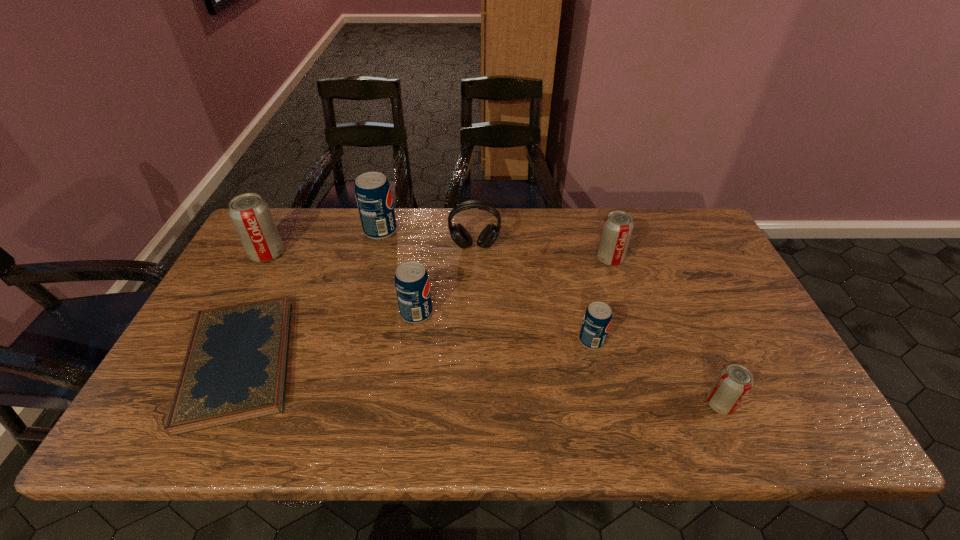
Locate an element on the screen. empty location between the rightmost soda can and the leftmost gray soda can is located at coordinates (493, 329).

At what (x,y) coordinates should I click in order to perform the action: click on blank region between the farthest soda can and the fifth object from left to right. Please return your answer as a coordinate pair (x, y). Looking at the image, I should click on (427, 239).

Locate an element on the screen. vacant space that is in between the fifth soda can from left to right and the third nearest soda can is located at coordinates (x=513, y=286).

This screenshot has height=540, width=960. In order to click on vacant space that's between the second gray soda can from left to right and the second soda can from left to right in this screenshot , I will do `click(495, 245)`.

Image resolution: width=960 pixels, height=540 pixels. In order to click on free space between the shortest object and the fourth object from right to left in this screenshot , I will do `click(357, 304)`.

Identify which object is the fifth closest to the second smallest blue pop. Please provide its 2D coordinates. Your answer should be formatted as a tuple, i.e. [(x, y)], where the tuple contains the x and y coordinates of a point satisfying the conditions above.

[(250, 214)]

In order to click on object that can be found as the closest to the biggest gray soda can in this screenshot , I will do `click(235, 368)`.

I want to click on soda can that is the nearest to the paperback book, so click(x=250, y=214).

Identify which soda can is the fourth closest to the leftmost blue pop. Please provide its 2D coordinates. Your answer should be formatted as a tuple, i.e. [(x, y)], where the tuple contains the x and y coordinates of a point satisfying the conditions above.

[(598, 316)]

In order to click on blue pop identified as the closest to the farthest soda can in this screenshot , I will do `click(412, 285)`.